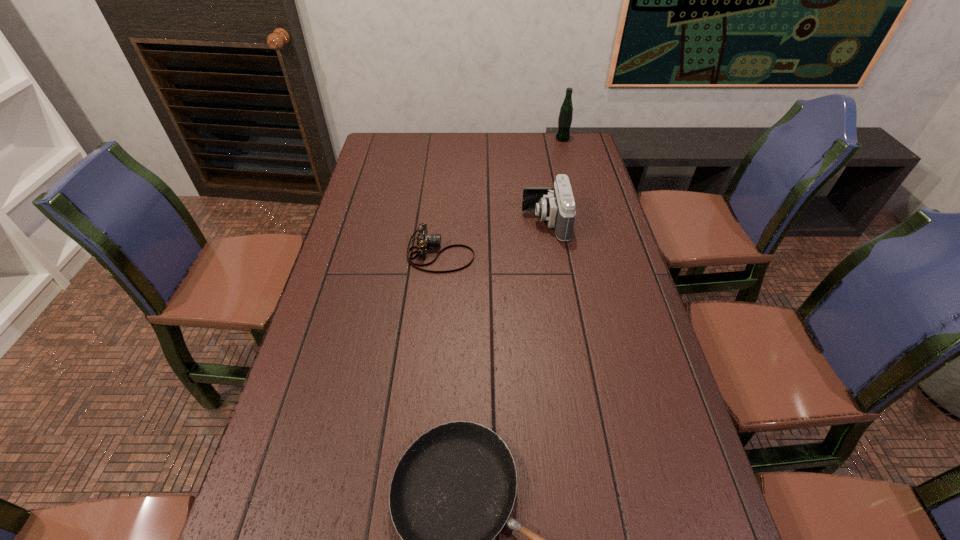
Find the location of a particular element. The height and width of the screenshot is (540, 960). the farthest object is located at coordinates (566, 111).

Locate an element on the screen. Image resolution: width=960 pixels, height=540 pixels. the tallest object is located at coordinates (566, 111).

Identify the location of the third shortest object. (556, 205).

Find the location of `the taller camera`. the taller camera is located at coordinates (556, 205).

Where is `the left camera`? the left camera is located at coordinates (424, 240).

Image resolution: width=960 pixels, height=540 pixels. Find the location of `the second shortest object`. the second shortest object is located at coordinates (424, 240).

Identify the location of vacant point located on the left of the tallest object. The height and width of the screenshot is (540, 960). (468, 139).

The image size is (960, 540). I want to click on vacant space situated 0.130m at the front of the right camera with an open lens cover, so click(x=483, y=222).

Where is `free location located at the front of the right camera with an open lens cover`? The image size is (960, 540). free location located at the front of the right camera with an open lens cover is located at coordinates pos(465,222).

Where is `free space located 0.340m at the front of the right camera with an open lens cover`? free space located 0.340m at the front of the right camera with an open lens cover is located at coordinates (420, 222).